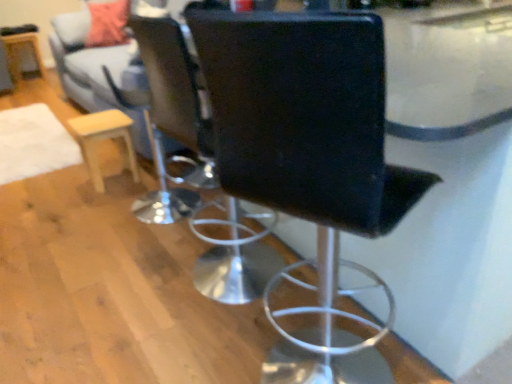
Image resolution: width=512 pixels, height=384 pixels. What are the coordinates of `vacant area situated to the left side of black leather chair at center, the 2th chair positioned from the front` in the screenshot? It's located at (125, 284).